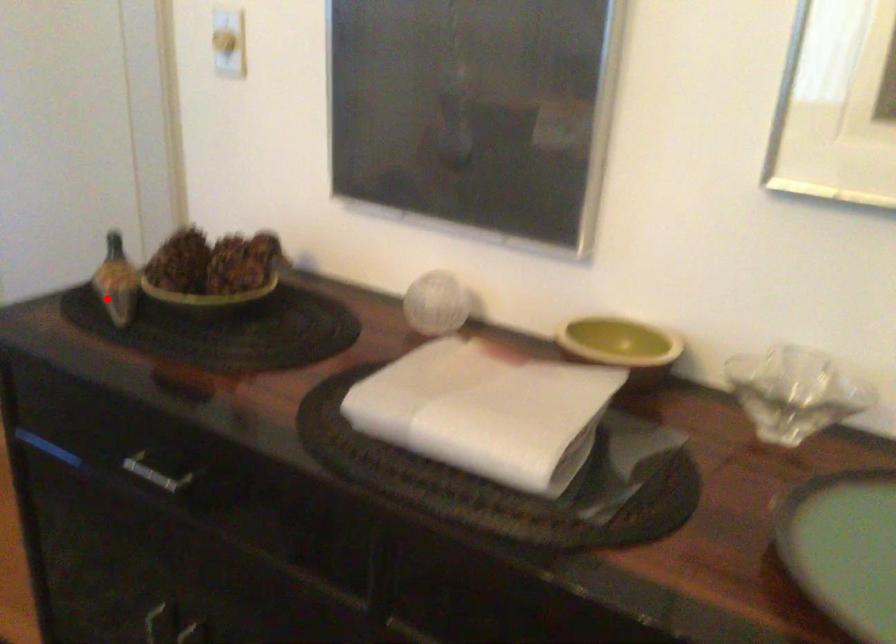
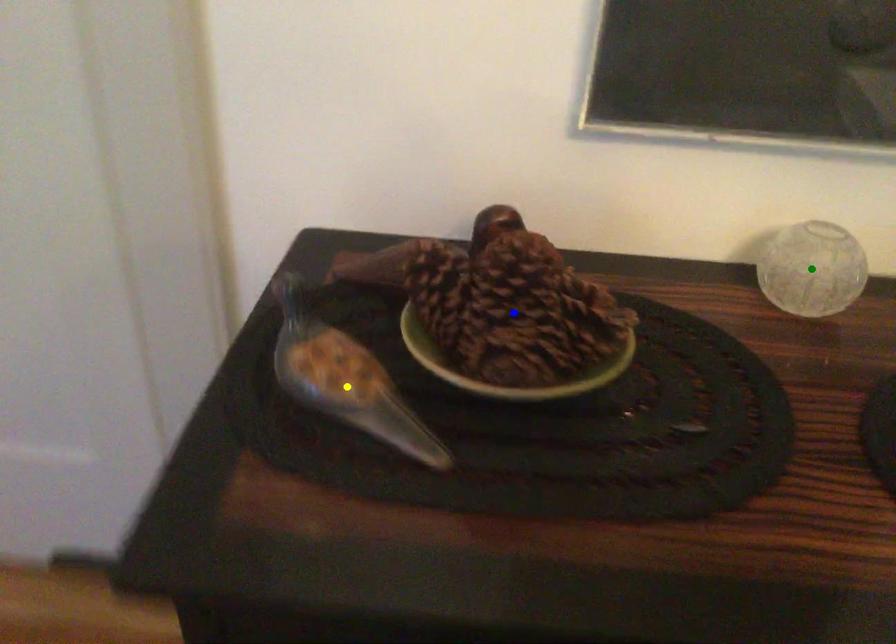
Question: I am providing you with two images of the same scene from different viewpoints. A red point is marked on the first image. You are given multiple points on the second image. In image 2, which mark is for the same physical point as the one in image 1?

Choices:
 (A) yellow point
 (B) green point
 (C) blue point

Answer: (A)